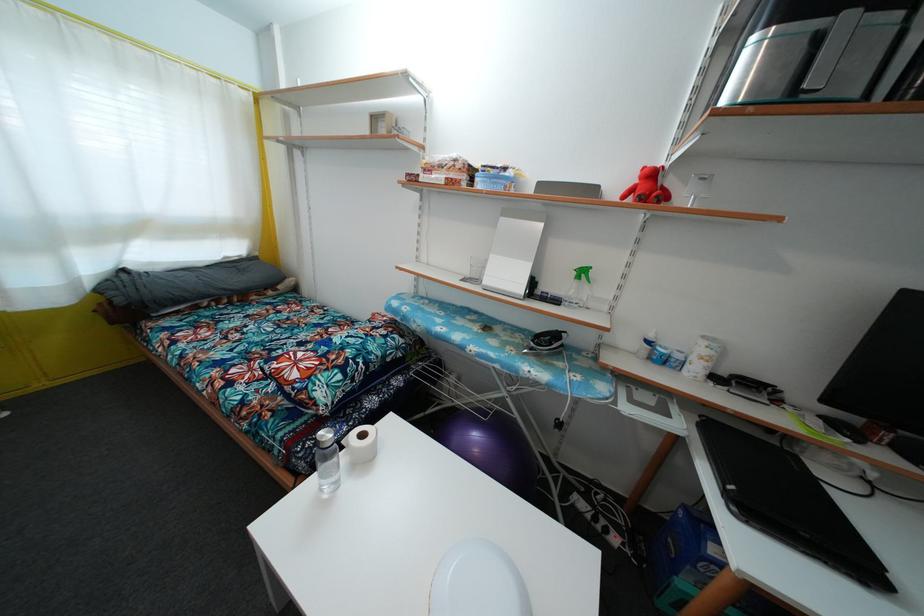
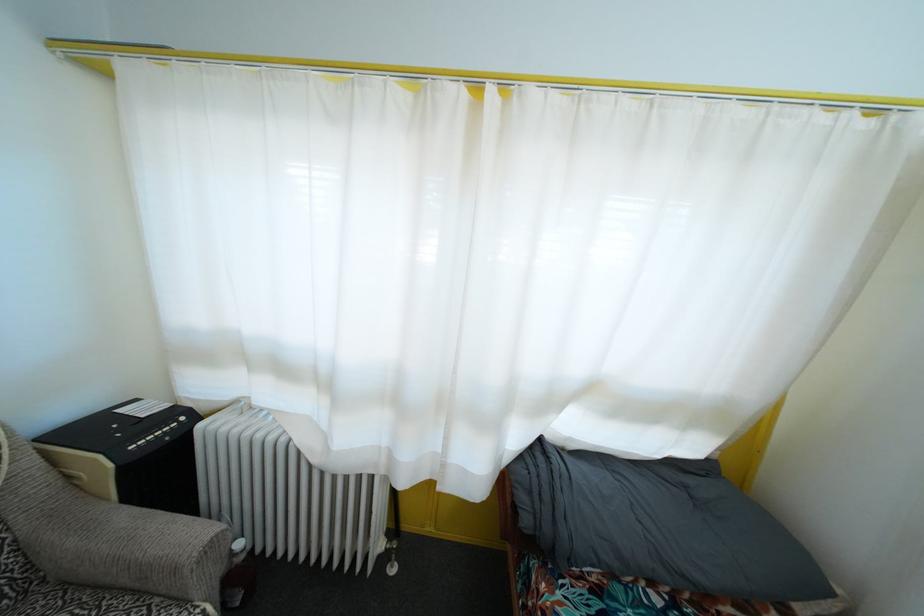
The point at (123, 307) is marked in the first image. Where is the corresponding point in the second image?

(529, 528)